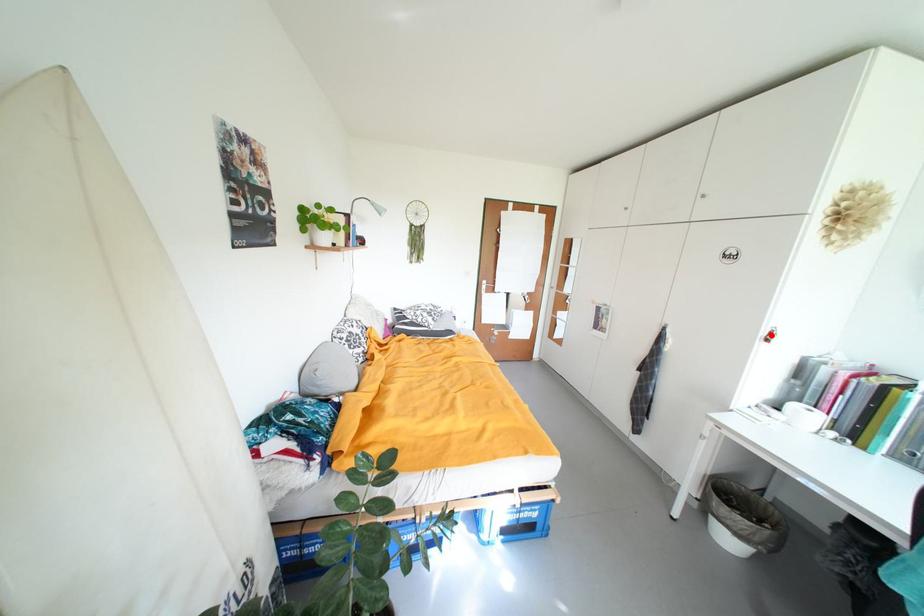
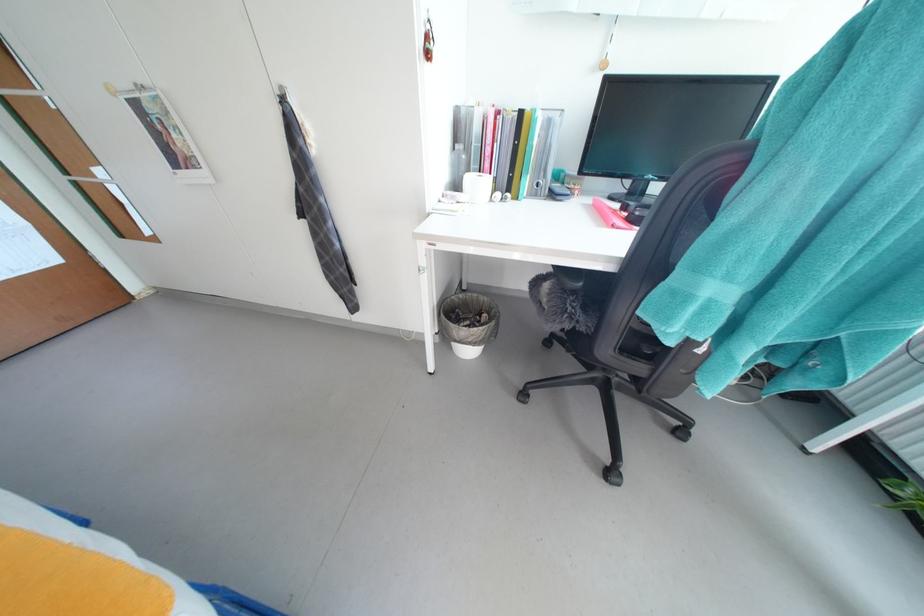
The point at the highlighted location is marked in the first image. Where is the corresponding point in the second image?

(428, 41)